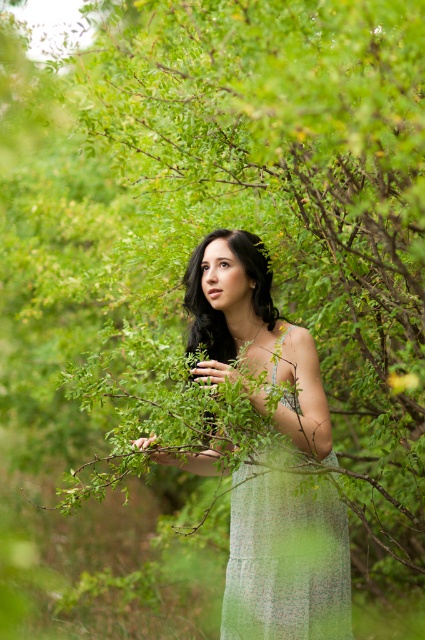
You are a GUI agent. You are given a task and a screenshot of the screen. Output one action in this format:
    pyautogui.click(x=<x>, y=<y>)
    Task: Click on the light green textured dress at center
    
    Given the screenshot: What is the action you would take?
    click(286, 556)

Does point (240, 230) come behind point (348, 589)?

Yes, point (240, 230) is farther from viewer.

Is point (286, 332) closer to viewer compared to point (334, 513)?

No, it is not.

This screenshot has height=640, width=425. I want to click on light green textured dress at center, so click(x=286, y=556).